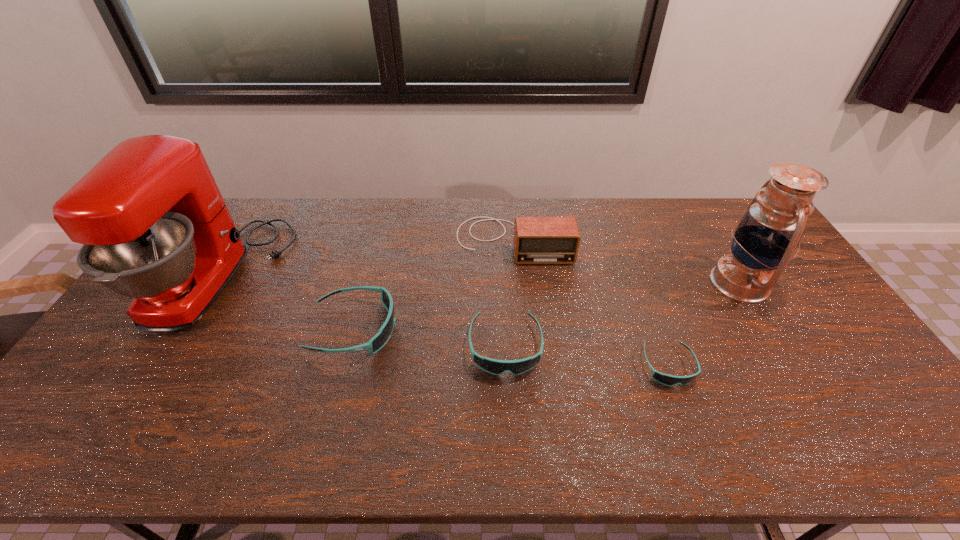
Where is `free spot that satisfies the following two spatial constraints: 1. on the front-facing side of the third tallest object; 2. on the front-facing side of the kitchen mixer`? free spot that satisfies the following two spatial constraints: 1. on the front-facing side of the third tallest object; 2. on the front-facing side of the kitchen mixer is located at coordinates (516, 277).